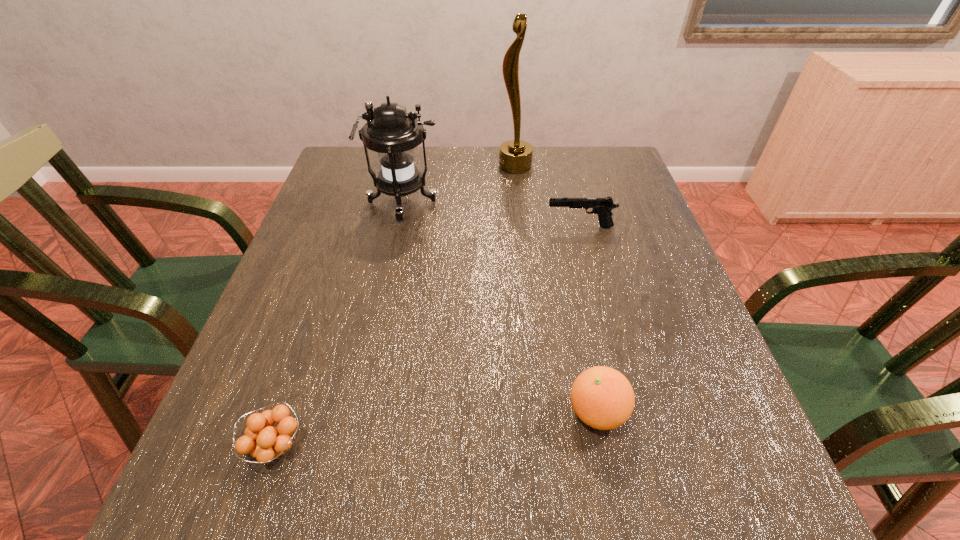
Image resolution: width=960 pixels, height=540 pixels. I want to click on orange fruit located in the left edge section of the desktop, so click(x=265, y=444).

You are a GUI agent. You are given a task and a screenshot of the screen. Output one action in this format:
    pyautogui.click(x=<x>, y=<y>)
    Task: Click on the object present at the right edge
    The height and width of the screenshot is (540, 960).
    Given the screenshot: What is the action you would take?
    pyautogui.click(x=602, y=206)

Locate an element on the screen. object positioned at the far left corner is located at coordinates (390, 131).

Identify the location of object positioned at the near left corner. The image size is (960, 540). (265, 444).

You are a GUI agent. You are given a task and a screenshot of the screen. Output one action in this format:
    pyautogui.click(x=<x>, y=<y>)
    Task: Click on the vacant area at the far edge of the desktop
    
    Given the screenshot: What is the action you would take?
    pyautogui.click(x=503, y=187)

Identify the location of free space at the near edge of the desktop. The image size is (960, 540). (556, 468).

I want to click on free space at the left edge, so click(x=331, y=265).

You are a GUI agent. You are given a task and a screenshot of the screen. Output one action in this format:
    pyautogui.click(x=<x>, y=<y>)
    Task: Click on the free space at the right edge of the desktop
    
    Given the screenshot: What is the action you would take?
    pyautogui.click(x=704, y=435)

Find the location of a particular element. This screenshot has height=540, width=960. vacant point at the near left corner is located at coordinates click(258, 520).

Locate an element on the screen. The image size is (960, 540). blank area at the far right corner is located at coordinates (588, 185).